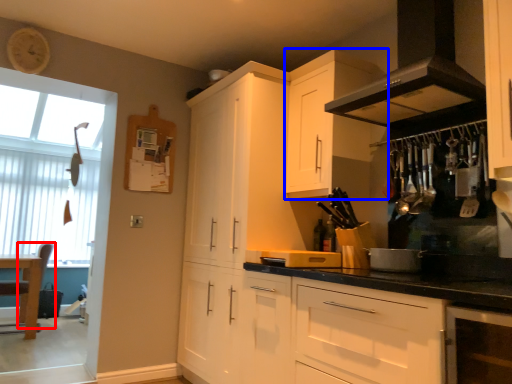
Question: Which point is further to the camera, chair (highlighted by a red box) or cabinetry (highlighted by a blue box)?

Choices:
 (A) chair
 (B) cabinetry

Answer: (A)